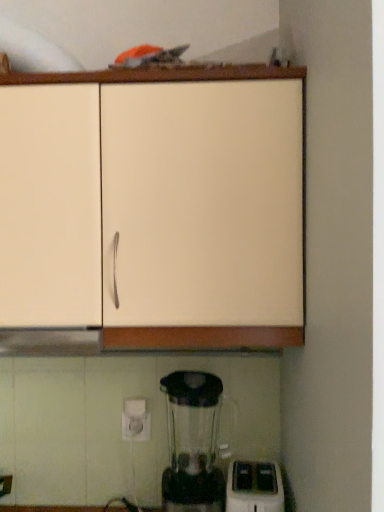
Measure the distance between matte white cabinet at upper center and camera.

They are 33.05 inches apart.

What do you see at coordinates (152, 210) in the screenshot? I see `matte white cabinet at upper center` at bounding box center [152, 210].

The width and height of the screenshot is (384, 512). Identify the location of matte white cabinet at upper center. (152, 210).

The height and width of the screenshot is (512, 384). Describe the element at coordinates (254, 487) in the screenshot. I see `white plastic toaster at lower right` at that location.

I want to click on white plastic toaster at lower right, so coord(254,487).

Where is `matte white cabinet at upper center`? This screenshot has height=512, width=384. matte white cabinet at upper center is located at coordinates 152,210.

Which is more to the left, white plastic toaster at lower right or matte white cabinet at upper center?

matte white cabinet at upper center is more to the left.

Between white plastic toaster at lower right and matte white cabinet at upper center, which one is positioned behind?

white plastic toaster at lower right is more distant.

Considering the points (240, 509) and (220, 207), which point is behind, point (240, 509) or point (220, 207)?

The point (240, 509) is farther.

From the image's perspective, which one is positioned higher, white plastic toaster at lower right or matte white cabinet at upper center?

matte white cabinet at upper center appears higher in the image.

From a real-world perspective, is white plastic toaster at lower right physically below matte white cabinet at upper center?

Yes, from a real-world perspective, white plastic toaster at lower right is below matte white cabinet at upper center.

Between white plastic toaster at lower right and matte white cabinet at upper center, which one has smaller width?

Thinner between the two is white plastic toaster at lower right.

Considering the relative sizes of white plastic toaster at lower right and matte white cabinet at upper center in the image provided, is white plastic toaster at lower right shorter than matte white cabinet at upper center?

Indeed, white plastic toaster at lower right has a lesser height compared to matte white cabinet at upper center.

Considering the sizes of white plastic toaster at lower right and matte white cabinet at upper center in the image, is white plastic toaster at lower right bigger or smaller than matte white cabinet at upper center?

Clearly, white plastic toaster at lower right is smaller in size than matte white cabinet at upper center.

Choose the correct answer: Is white plastic toaster at lower right inside matte white cabinet at upper center or outside it?

The correct answer is: outside.

Is white plastic toaster at lower right far from matte white cabinet at upper center?

No, white plastic toaster at lower right is not far away from matte white cabinet at upper center.

Is white plastic toaster at lower right facing towards matte white cabinet at upper center?

No, white plastic toaster at lower right does not turn towards matte white cabinet at upper center.

This screenshot has width=384, height=512. I want to click on home appliance below the matte white cabinet at upper center (from a real-world perspective), so click(254, 487).

From the picture: Is matte white cabinet at upper center to the left of white plastic toaster at lower right from the viewer's perspective?

Indeed, matte white cabinet at upper center is positioned on the left side of white plastic toaster at lower right.

Does matte white cabinet at upper center come in front of white plastic toaster at lower right?

Yes, matte white cabinet at upper center is in front of white plastic toaster at lower right.

Which point is more distant from viewer, (288,255) or (266,461)?

The point (266,461) is behind.

From the image's perspective, who appears lower, matte white cabinet at upper center or white plastic toaster at lower right?

white plastic toaster at lower right appears lower in the image.

From a real-world perspective, is matte white cabinet at upper center above or below white plastic toaster at lower right?

In terms of real-world spatial position, matte white cabinet at upper center is above white plastic toaster at lower right.

Is matte white cabinet at upper center wider than white plastic toaster at lower right?

Correct, the width of matte white cabinet at upper center exceeds that of white plastic toaster at lower right.

Does matte white cabinet at upper center have a greater height compared to white plastic toaster at lower right?

Yes, matte white cabinet at upper center is taller than white plastic toaster at lower right.

Who is smaller, matte white cabinet at upper center or white plastic toaster at lower right?

white plastic toaster at lower right.

Is matte white cabinet at upper center spatially inside white plastic toaster at lower right, or outside of it?

matte white cabinet at upper center is located beyond the bounds of white plastic toaster at lower right.

Would you say matte white cabinet at upper center is a long distance from white plastic toaster at lower right?

No.

Is white plastic toaster at lower right at the back of matte white cabinet at upper center?

No, matte white cabinet at upper center is not facing away from white plastic toaster at lower right.

Can you tell me how much matte white cabinet at upper center and white plastic toaster at lower right differ in facing direction?

5.19 degrees separate the facing orientations of matte white cabinet at upper center and white plastic toaster at lower right.

Locate an element on the screen. Image resolution: width=384 pixels, height=512 pixels. cabinetry above the white plastic toaster at lower right (from the image's perspective) is located at coordinates (152, 210).

Find the location of a particular element. The height and width of the screenshot is (512, 384). home appliance on the right of matte white cabinet at upper center is located at coordinates (254, 487).

Where is `cabinetry above the white plastic toaster at lower right (from a real-world perspective)`? This screenshot has width=384, height=512. cabinetry above the white plastic toaster at lower right (from a real-world perspective) is located at coordinates (152, 210).